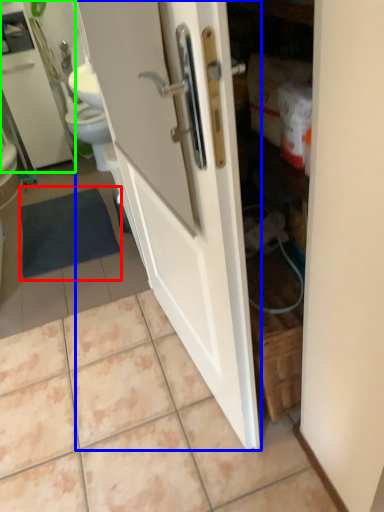
Question: Considering the real-world distances, which object is closest to bath mat (highlighted by a red box)? door (highlighted by a blue box) or medicine cabinet (highlighted by a green box).

Choices:
 (A) door
 (B) medicine cabinet

Answer: (B)